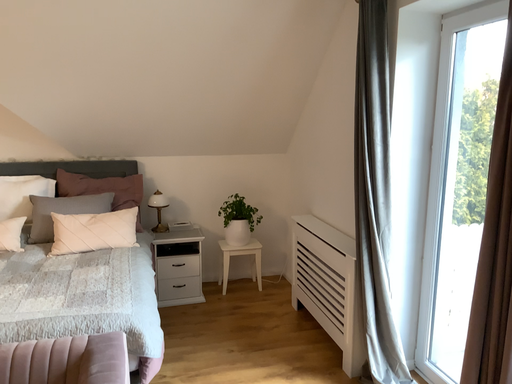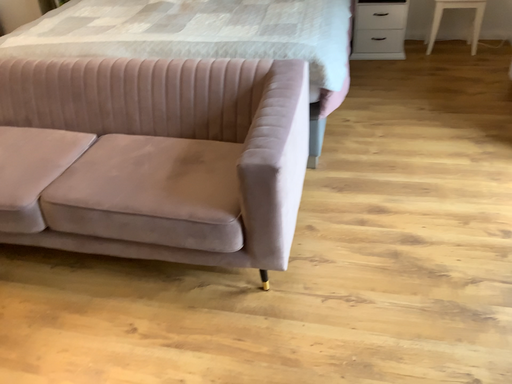
Question: Which way did the camera rotate in the video?

Choices:
 (A) rotated downward
 (B) rotated upward

Answer: (A)